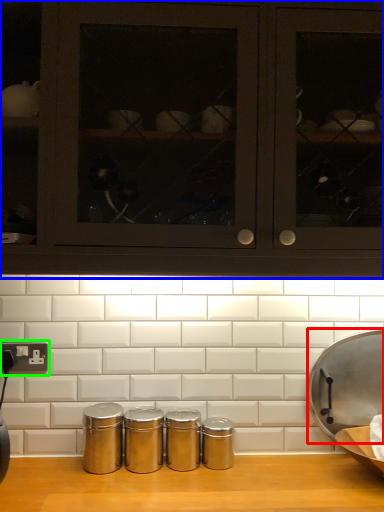
Question: Which object is positioned farthest from wide (highlighted by a red box)? Select from cabinetry (highlighted by a blue box) and electric outlet (highlighted by a green box).

Choices:
 (A) cabinetry
 (B) electric outlet

Answer: (B)